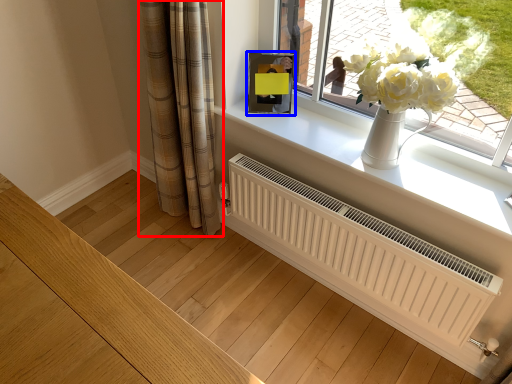
Question: Which point is closer to the camera, curtain (highlighted by a red box) or picture frame (highlighted by a blue box)?

Choices:
 (A) curtain
 (B) picture frame

Answer: (A)